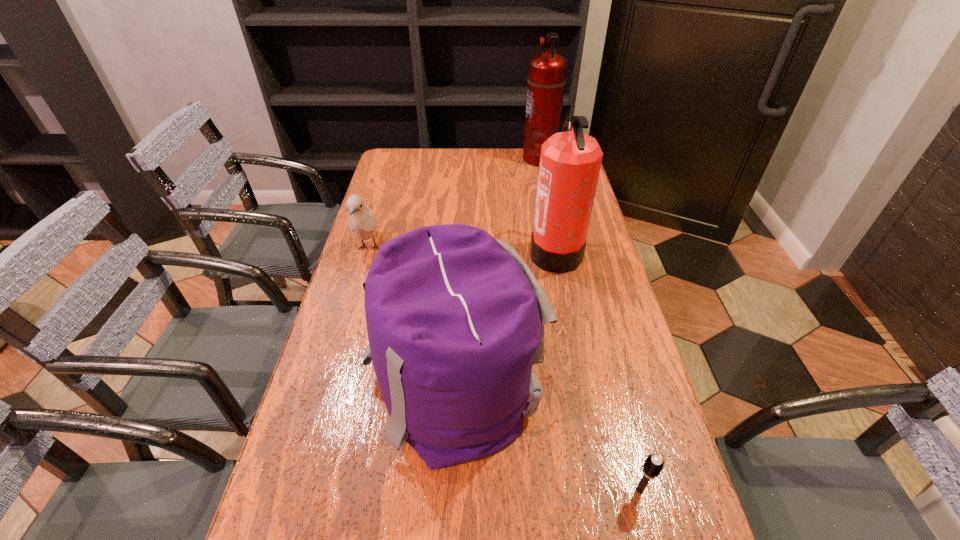
In order to click on the farthest object in this screenshot , I will do `click(546, 80)`.

Identify the location of the nearer fire extinguisher. (570, 161).

This screenshot has width=960, height=540. Identify the location of backpack. (455, 319).

Where is `the fourth object from right to left`? The image size is (960, 540). the fourth object from right to left is located at coordinates (455, 319).

Where is `bird`? The height and width of the screenshot is (540, 960). bird is located at coordinates (362, 220).

Locate an element on the screen. The height and width of the screenshot is (540, 960). the leftmost object is located at coordinates (362, 220).

Where is `the shortest object`? the shortest object is located at coordinates (653, 465).

You are a GUI agent. You are given a task and a screenshot of the screen. Output one action in this format:
    pyautogui.click(x=<x>, y=<y>)
    Task: Click on the hairbrush
    The width and height of the screenshot is (960, 540).
    Given the screenshot: What is the action you would take?
    pyautogui.click(x=653, y=465)

Image resolution: width=960 pixels, height=540 pixels. What are the coordinates of `blank space located on the nozzle side of the farther fire extinguisher` in the screenshot? It's located at (436, 158).

In order to click on vacant area situated 0.100m on the nozzle side of the farther fire extinguisher in this screenshot , I will do coord(498,158).